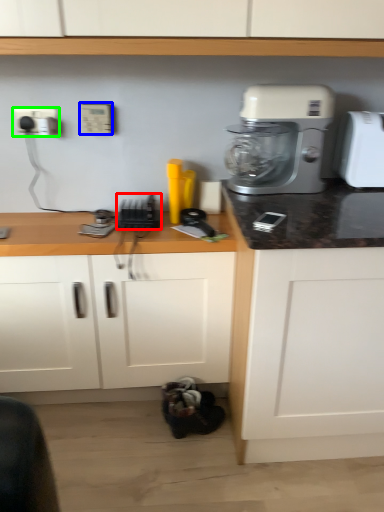
Question: Considering the real-world distances, which object is farthest from appliance (highlighted by a red box)? electric outlet (highlighted by a blue box) or electric outlet (highlighted by a green box)?

Choices:
 (A) electric outlet
 (B) electric outlet

Answer: (B)